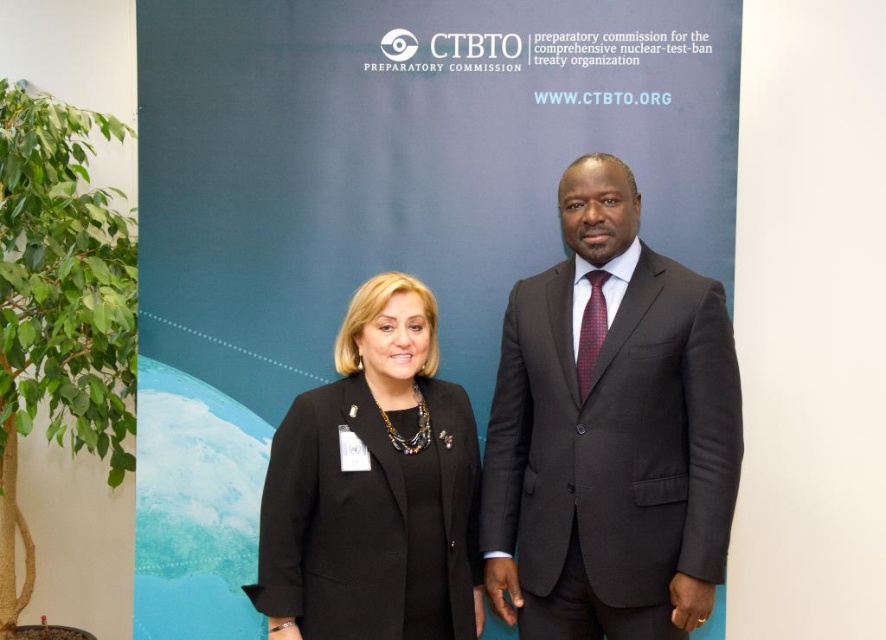
From the picture: Between blue fabric banner at center and black fabric jacket at center, which one is positioned higher?

Positioned higher is blue fabric banner at center.

Who is shorter, blue fabric banner at center or black fabric jacket at center?

black fabric jacket at center

Is point (192, 83) positioned after point (387, 592)?

That is True.

The image size is (886, 640). I want to click on blue fabric banner at center, so (x=375, y=212).

Is blue fabric banner at center to the right of dark gray suit at center from the viewer's perspective?

In fact, blue fabric banner at center is to the left of dark gray suit at center.

Is point (509, 204) farther from viewer compared to point (587, 474)?

Yes, point (509, 204) is behind point (587, 474).

Who is more distant from viewer, (224, 515) or (616, 336)?

The point (224, 515) is behind.

I want to click on blue fabric banner at center, so click(x=375, y=212).

Does dark gray suit at center have a lesser height compared to black fabric jacket at center?

In fact, dark gray suit at center may be taller than black fabric jacket at center.

Does dark gray suit at center appear under black fabric jacket at center?

Actually, dark gray suit at center is above black fabric jacket at center.

Who is more distant from viewer, (x=684, y=467) or (x=371, y=426)?

Point (x=371, y=426)

Where is `dark gray suit at center`? This screenshot has height=640, width=886. dark gray suit at center is located at coordinates (610, 433).